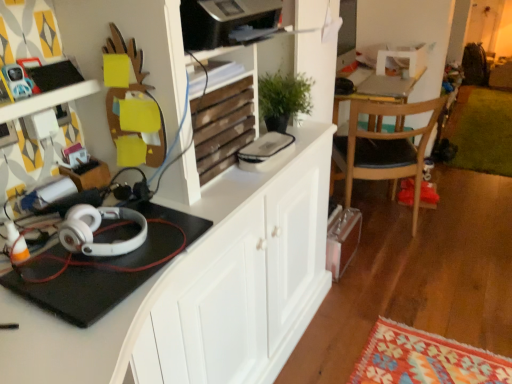
What are the coordinates of `vacant space in wooden chair with black seat cushion at right (from a real-world perspective)` in the screenshot? It's located at (382, 217).